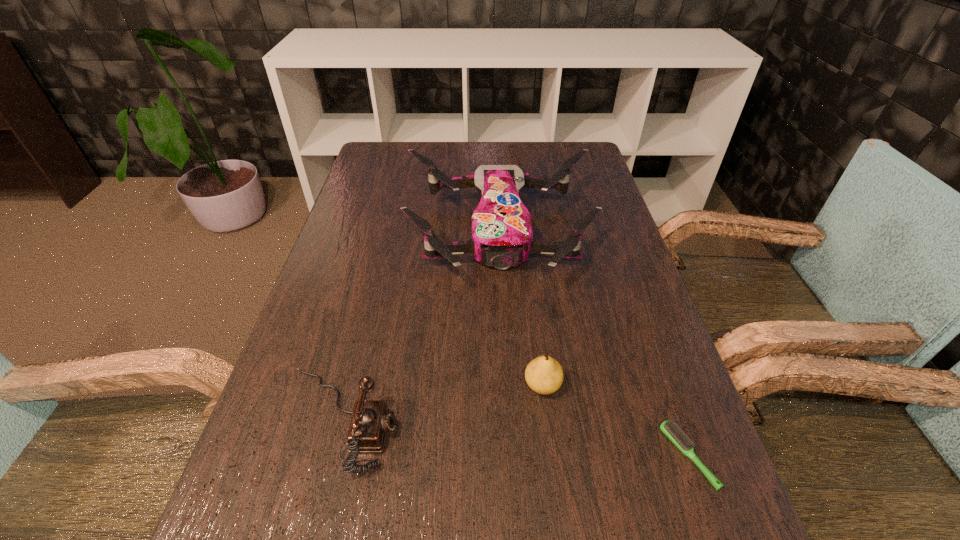
Find the location of a particular element. drone situated at the right edge is located at coordinates (502, 233).

Locate an element on the screen. This screenshot has height=540, width=960. hairbrush present at the right edge is located at coordinates (671, 430).

Find the location of a particular element. The image size is (960, 540). free space at the far edge is located at coordinates pos(425,172).

Locate an element on the screen. vacant space at the left edge of the desktop is located at coordinates (366, 240).

What are the coordinates of `free point at the right edge` in the screenshot? It's located at (610, 254).

The width and height of the screenshot is (960, 540). In order to click on free region at the far left corner in this screenshot , I will do `click(383, 148)`.

The width and height of the screenshot is (960, 540). I want to click on free space at the far right corner of the desktop, so click(x=555, y=143).

You are a GUI agent. You are given a task and a screenshot of the screen. Output one action in this format:
    pyautogui.click(x=<x>, y=<y>)
    Task: Click on the free space between the shortest object and the tallest object
    The width and height of the screenshot is (960, 540).
    Given the screenshot: What is the action you would take?
    pyautogui.click(x=594, y=344)

This screenshot has width=960, height=540. I want to click on vacant space that is in between the telephone and the pear, so click(x=442, y=402).

Identify the location of free area in between the hairbrush and the tallest object. (594, 344).